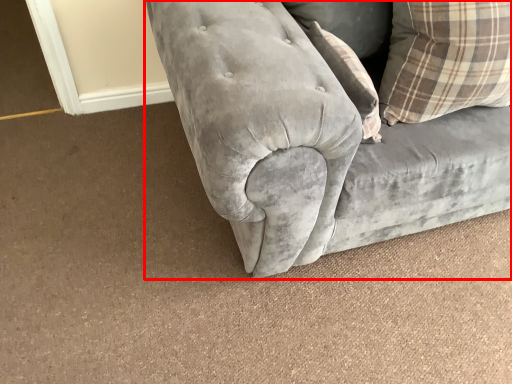
Question: From the image's perspective, where is studio couch (annotated by the red box) located relative to pillow?

Choices:
 (A) below
 (B) above

Answer: (B)